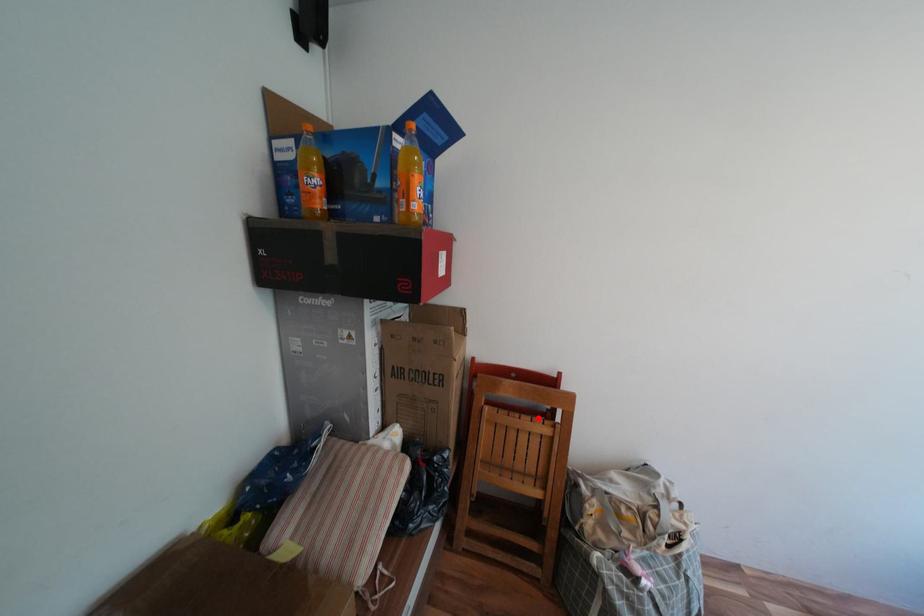
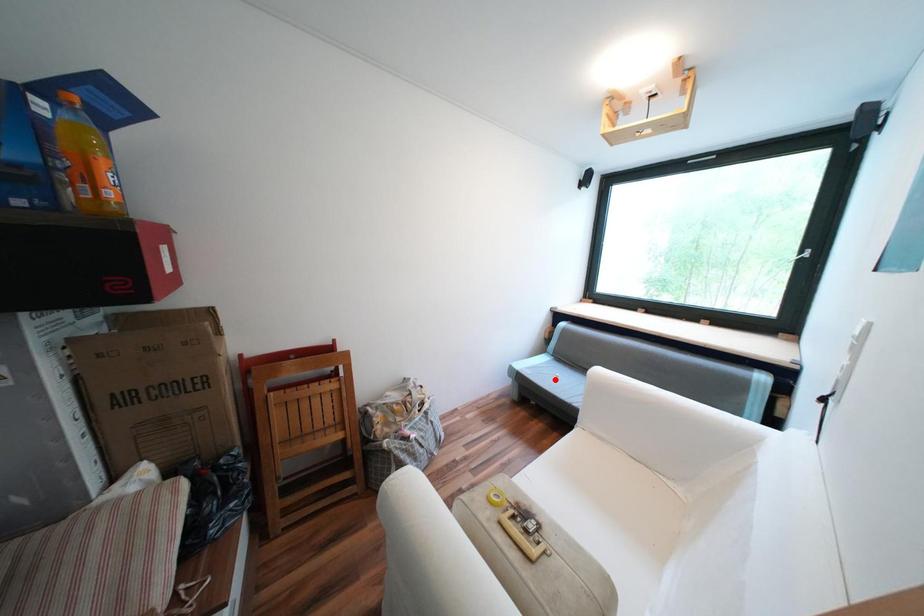
I am providing you with two images of the same scene from different viewpoints. A red point is marked on the first image and another point is marked on the second image. Do the highlighted points in image1 and image2 indicate the same real-world spot?

No